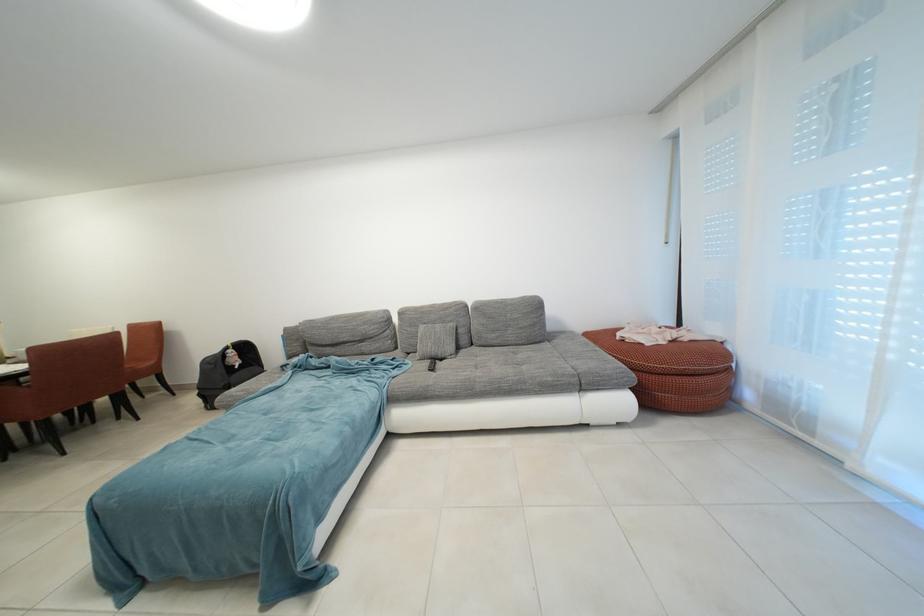
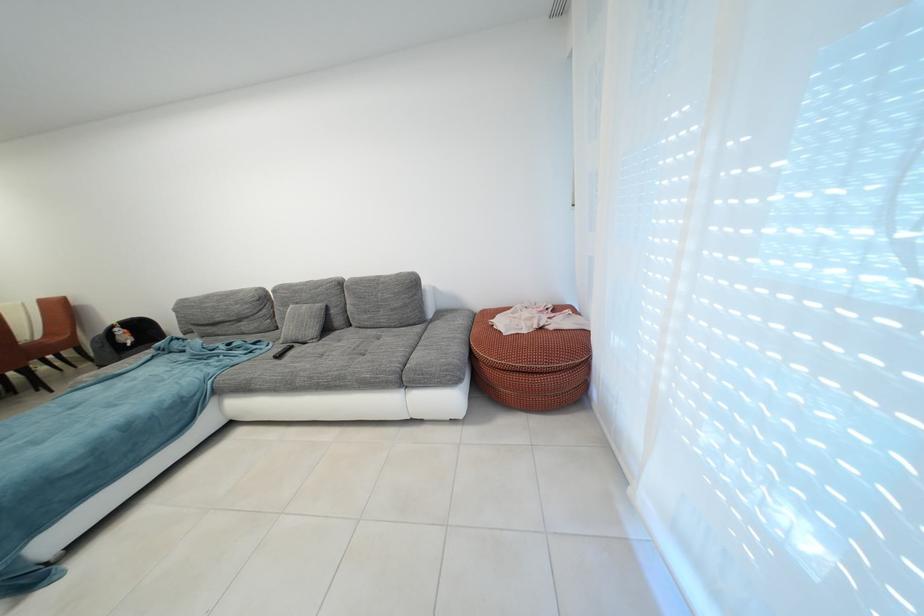
Locate, in the second image, the point that corresponds to [627,339] in the first image.

(506, 321)